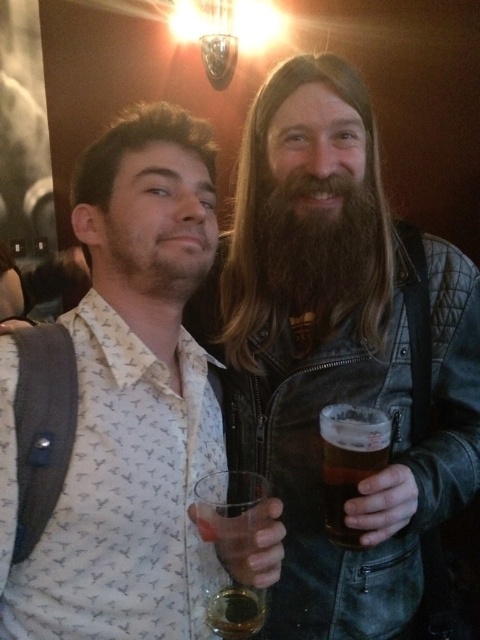
Can you confirm if leather jacket at center is positioned to the right of translucent glass at lower center?

Yes, leather jacket at center is to the right of translucent glass at lower center.

Locate an element on the screen. The image size is (480, 640). leather jacket at center is located at coordinates (339, 352).

I want to click on leather jacket at center, so click(x=339, y=352).

Is brown fuzzy beard at center wider than translucent glass at lower center?

Yes.

Does brown fuzzy beard at center have a smaller size compared to translucent glass at lower center?

No.

Where is `brown fuzzy beard at center`? Image resolution: width=480 pixels, height=640 pixels. brown fuzzy beard at center is located at coordinates (323, 246).

Which of these two, white printed shirt at center or brown fuzzy beard at center, stands taller?

With more height is white printed shirt at center.

Between white printed shirt at center and brown fuzzy beard at center, which one appears on the left side from the viewer's perspective?

From the viewer's perspective, white printed shirt at center appears more on the left side.

Is point (157, 236) closer to camera compared to point (315, 230)?

Yes, it is in front of point (315, 230).

Identify the location of white printed shirt at center. (127, 401).